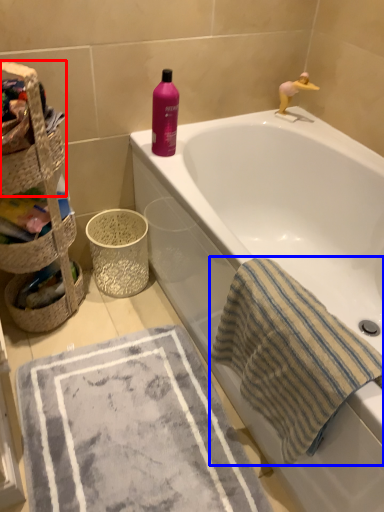
Question: Which object is further to the camera taking this photo, basket container (highlighted by a red box) or beach towel (highlighted by a blue box)?

Choices:
 (A) basket container
 (B) beach towel

Answer: (A)